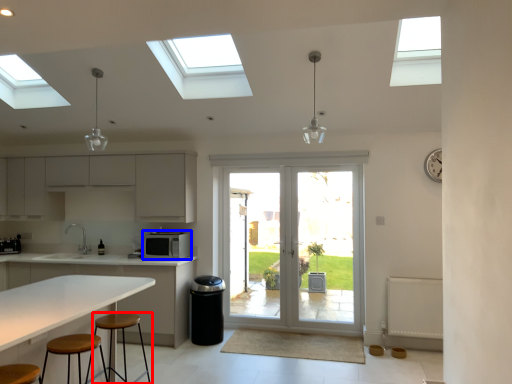
Question: Which object appears closest to the camera in this image, stool (highlighted by a red box) or appliance (highlighted by a blue box)?

Choices:
 (A) stool
 (B) appliance

Answer: (A)